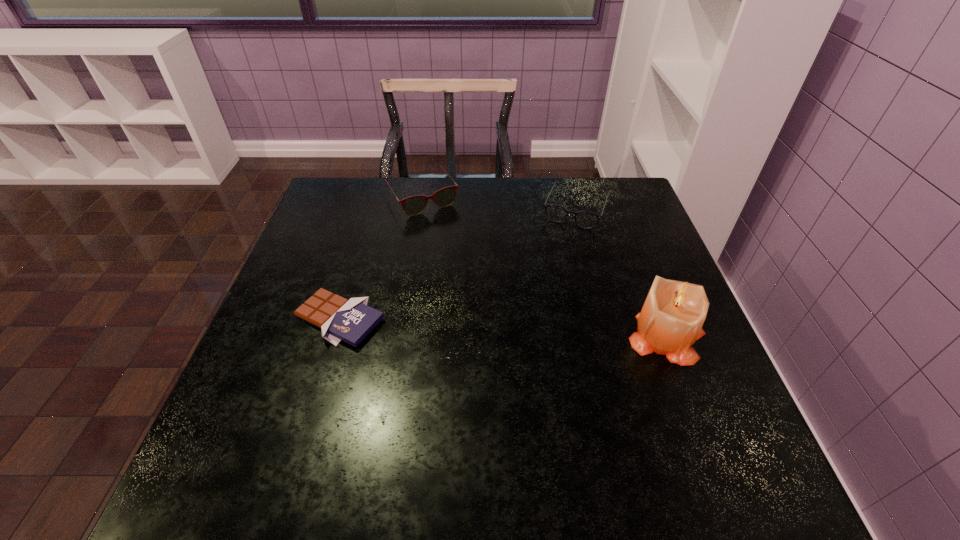
Find the location of a particular element. The width and height of the screenshot is (960, 540). chocolate bar is located at coordinates (351, 320).

This screenshot has width=960, height=540. I want to click on candle, so (x=671, y=319).

Where is `the right spectacles`? This screenshot has width=960, height=540. the right spectacles is located at coordinates (584, 219).

Find the location of a particular element. the left spectacles is located at coordinates (414, 205).

I want to click on vacant space located on the back of the shortest object, so click(x=352, y=278).

Identify the location of vacant space situated 0.050m on the back of the candle. Image resolution: width=960 pixels, height=540 pixels. (652, 296).

The height and width of the screenshot is (540, 960). Find the location of `vacant area situated through the lenses of the right spectacles`. vacant area situated through the lenses of the right spectacles is located at coordinates (555, 264).

Where is `vacant region located 0.350m through the lenses of the right spectacles`? vacant region located 0.350m through the lenses of the right spectacles is located at coordinates (534, 320).

I want to click on free space located through the lenses of the right spectacles, so click(562, 247).

This screenshot has height=540, width=960. I want to click on free space located 0.270m at the front view of the left spectacles, so click(478, 275).